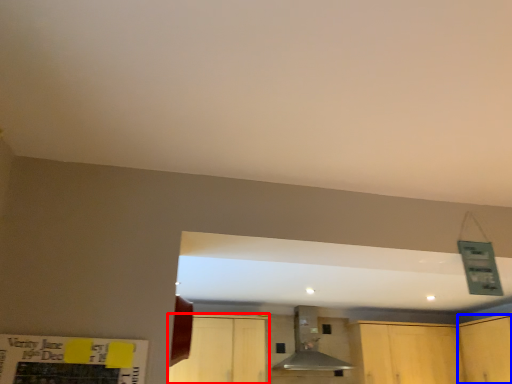
Question: Which object is closer to the camera taking this photo, cabinetry (highlighted by a red box) or cabinetry (highlighted by a blue box)?

Choices:
 (A) cabinetry
 (B) cabinetry

Answer: (B)